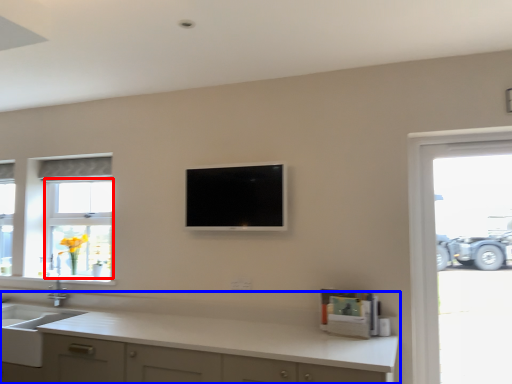
Question: Which object appears closest to the camera in this image, bay window (highlighted by a red box) or countertop (highlighted by a blue box)?

Choices:
 (A) bay window
 (B) countertop

Answer: (B)